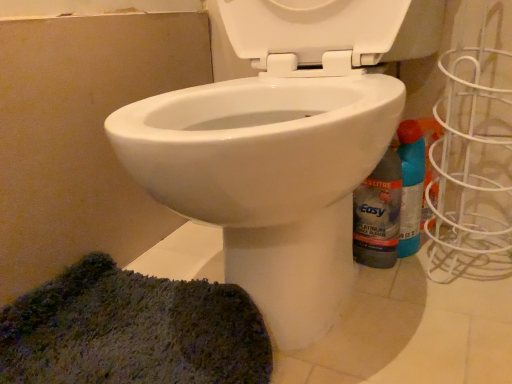
Question: Considering the relative sizes of translucent plastic bottle at lower right and blue plastic spray bottle at right in the image provided, is translucent plastic bottle at lower right wider than blue plastic spray bottle at right?

Choices:
 (A) no
 (B) yes

Answer: (A)

Question: Can you confirm if translucent plastic bottle at lower right is bigger than blue plastic spray bottle at right?

Choices:
 (A) yes
 (B) no

Answer: (B)

Question: Does translucent plastic bottle at lower right lie in front of blue plastic spray bottle at right?

Choices:
 (A) yes
 (B) no

Answer: (A)

Question: Does translucent plastic bottle at lower right turn towards blue plastic spray bottle at right?

Choices:
 (A) no
 (B) yes

Answer: (A)

Question: Considering the relative sizes of translucent plastic bottle at lower right and blue plastic spray bottle at right in the image provided, is translucent plastic bottle at lower right shorter than blue plastic spray bottle at right?

Choices:
 (A) yes
 (B) no

Answer: (B)

Question: Looking at the image, does green textured rug at lower left seem bigger or smaller compared to translucent plastic bottle at lower right?

Choices:
 (A) big
 (B) small

Answer: (A)

Question: Looking at their shapes, would you say green textured rug at lower left is wider or thinner than translucent plastic bottle at lower right?

Choices:
 (A) thin
 (B) wide

Answer: (B)

Question: Based on their positions, is green textured rug at lower left located to the left or right of translucent plastic bottle at lower right?

Choices:
 (A) right
 (B) left

Answer: (B)

Question: In the image, is green textured rug at lower left positioned in front of or behind translucent plastic bottle at lower right?

Choices:
 (A) front
 (B) behind

Answer: (A)

Question: Considering the positions of blue plastic spray bottle at right and green textured rug at lower left in the image, is blue plastic spray bottle at right wider or thinner than green textured rug at lower left?

Choices:
 (A) thin
 (B) wide

Answer: (A)

Question: Is point (419, 175) closer or farther from the camera than point (160, 370)?

Choices:
 (A) farther
 (B) closer

Answer: (A)

Question: From the image's perspective, is blue plastic spray bottle at right positioned above or below green textured rug at lower left?

Choices:
 (A) above
 (B) below

Answer: (A)

Question: From a real-world perspective, relative to green textured rug at lower left, is blue plastic spray bottle at right vertically above or below?

Choices:
 (A) above
 (B) below

Answer: (A)

Question: From a real-world perspective, is green textured rug at lower left positioned above or below blue plastic spray bottle at right?

Choices:
 (A) below
 (B) above

Answer: (A)

Question: Is point (50, 365) positioned closer to the camera than point (408, 152)?

Choices:
 (A) farther
 (B) closer

Answer: (B)